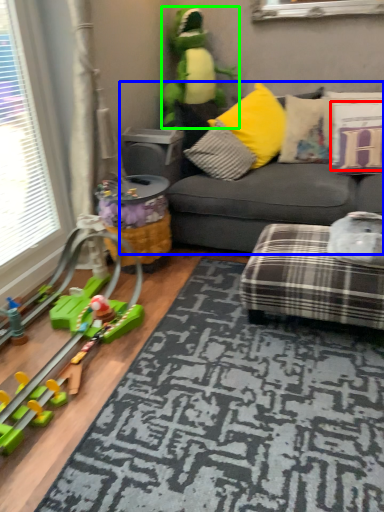
Question: Based on their relative distances, which object is farther from pillow (highlighted by a red box)? Choose from studio couch (highlighted by a blue box) and toy (highlighted by a green box).

Choices:
 (A) studio couch
 (B) toy

Answer: (B)